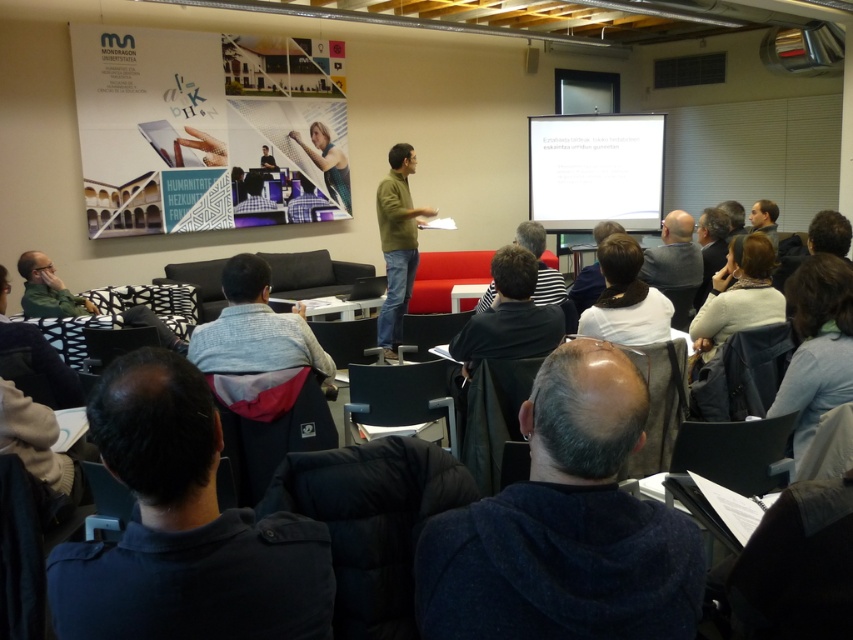
You are an attendee in the classroom and need to move from your seat to the front. There is a white matte projection screen at upper center and a patterned fabric couch at lower left in your way. Which object is wider so you can decide the best path around them?

The white matte projection screen at upper center is wider than the patterned fabric couch at lower left, so you should go around the couch to avoid the wider screen.

You are sitting on the patterned fabric couch at lower left and want to watch the presentation on the white matte projection screen at upper center. In which direction should you turn your head to look at the screen?

You should turn your head to the right to look at the white matte projection screen at upper center because it is located to the right of the patterned fabric couch at lower left.

You are an attendee sitting in the classroom and you notice two items in the scene. One is the dark blue fabric at lower left and the other is the brown hair at upper center. Which of these two items is closer to the floor?

The dark blue fabric at lower left is closer to the floor because it is shorter than the brown hair at upper center.